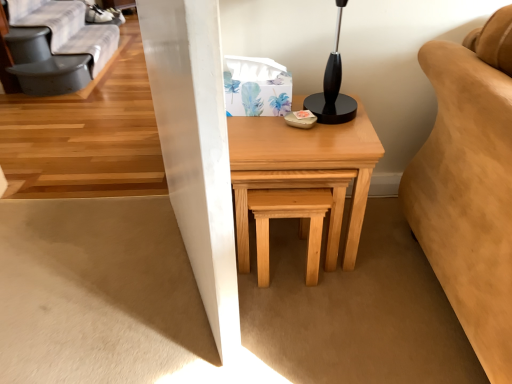
Question: Considering the positions of natural wood table at center and natural wood stool at center in the image, is natural wood table at center taller or shorter than natural wood stool at center?

Choices:
 (A) tall
 (B) short

Answer: (A)

Question: In the image, is natural wood table at center positioned in front of or behind natural wood stool at center?

Choices:
 (A) behind
 (B) front

Answer: (B)

Question: Estimate the real-world distances between objects in this image. Which object is farther from the natural wood stool at center?

Choices:
 (A) gray fabric futon at upper left
 (B) natural wood table at center

Answer: (A)

Question: Based on their relative distances, which object is nearer to the natural wood stool at center?

Choices:
 (A) gray fabric futon at upper left
 (B) natural wood table at center

Answer: (B)